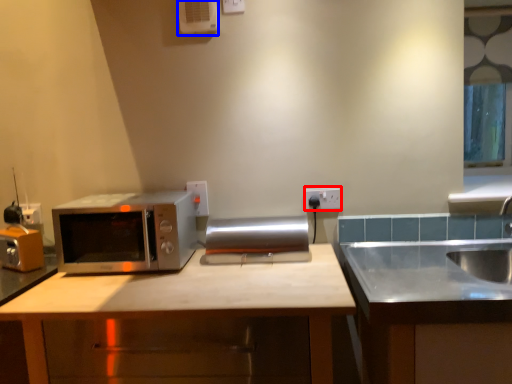
Question: Which object is closer to the camera taking this photo, electric outlet (highlighted by a red box) or air conditioner (highlighted by a blue box)?

Choices:
 (A) electric outlet
 (B) air conditioner

Answer: (B)